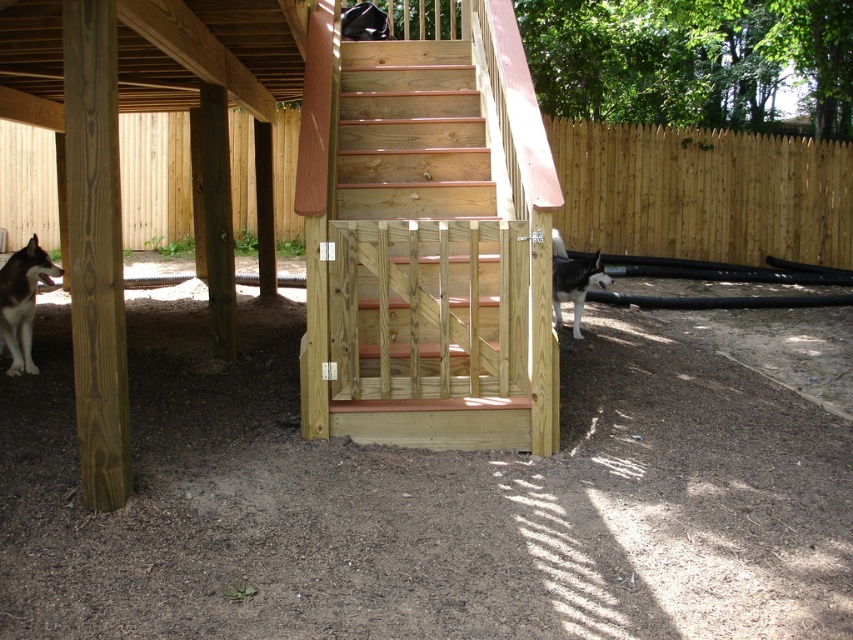
Question: Which object is positioned farthest from the white fur dog at lower left?

Choices:
 (A) white fur dog at right
 (B) natural wood stairs at center

Answer: (A)

Question: Can you confirm if natural wood stairs at center is bigger than white fur dog at right?

Choices:
 (A) no
 (B) yes

Answer: (B)

Question: Which of the following is the closest to the observer?

Choices:
 (A) (399, 106)
 (B) (573, 330)

Answer: (A)

Question: Which is farther from the white fur dog at right?

Choices:
 (A) white fur dog at lower left
 (B) natural wood stairs at center

Answer: (A)

Question: Can you confirm if white fur dog at lower left is positioned to the left of white fur dog at right?

Choices:
 (A) no
 (B) yes

Answer: (B)

Question: Is natural wood stairs at center behind white fur dog at lower left?

Choices:
 (A) no
 (B) yes

Answer: (A)